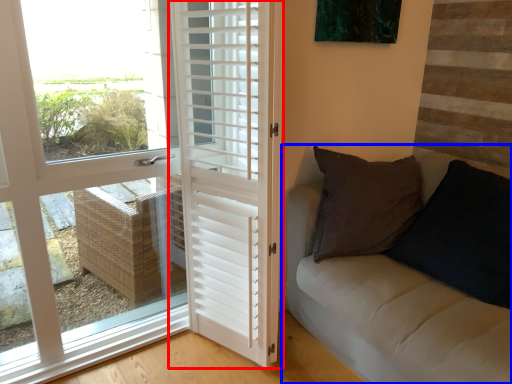
Question: Which point is further to the camera, door (highlighted by a red box) or studio couch (highlighted by a blue box)?

Choices:
 (A) door
 (B) studio couch

Answer: (A)